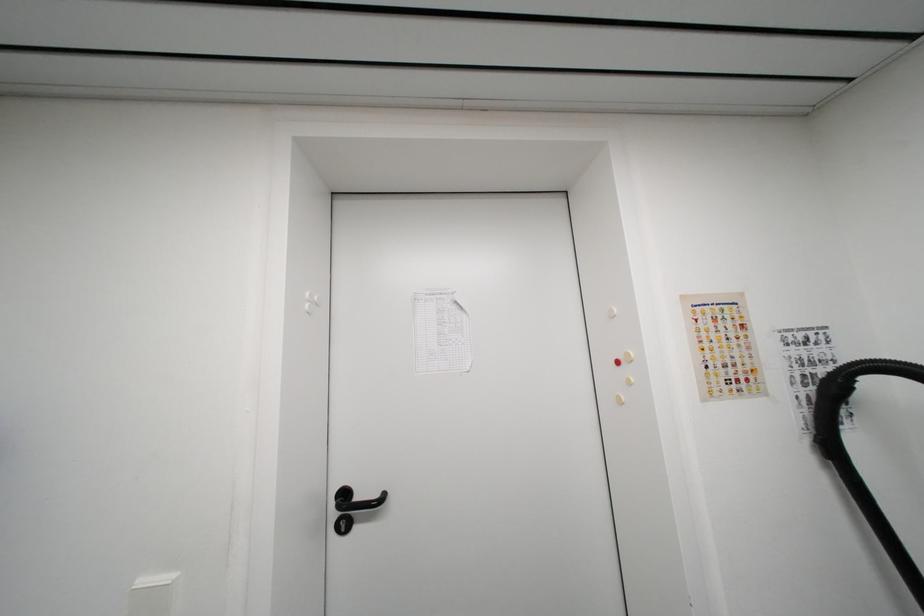
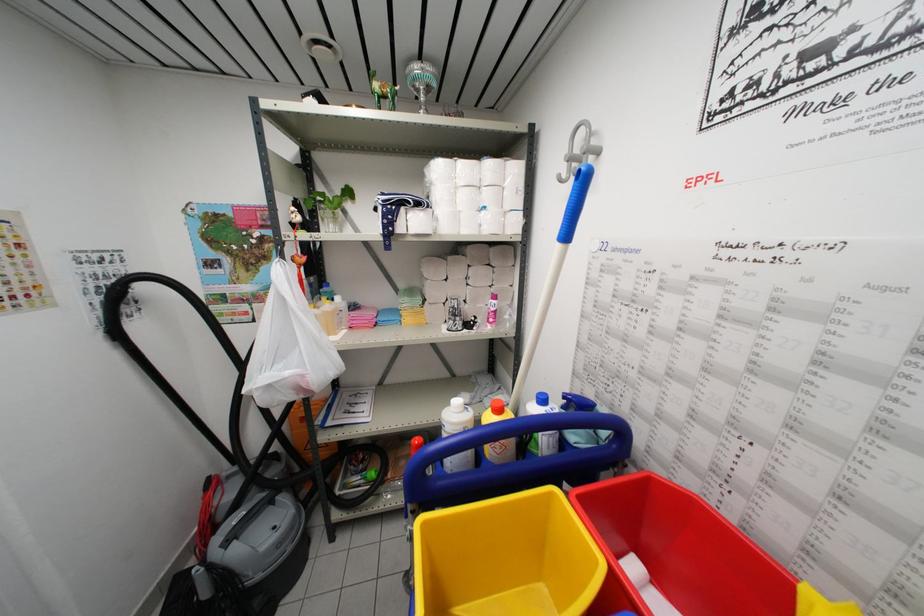
Question: The images are taken continuously from a first-person perspective. In which direction is your viewpoint rotating?

Choices:
 (A) Left
 (B) Right
 (C) Up
 (D) Down

Answer: (B)